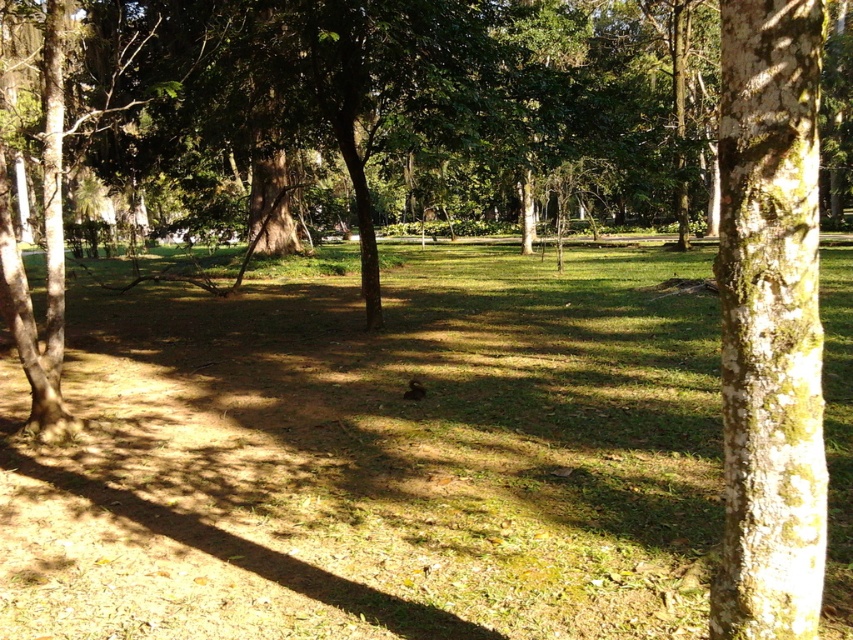
Is point (216, 428) less distant than point (761, 326)?

No, (216, 428) is further to viewer.

Which of these two, green grassy at center or green mossy bark tree trunk at right, stands taller?

green grassy at center

Between point (361, 372) and point (769, 54), which one is positioned in front?

Point (769, 54)

The width and height of the screenshot is (853, 640). I want to click on green grassy at center, so click(x=380, y=460).